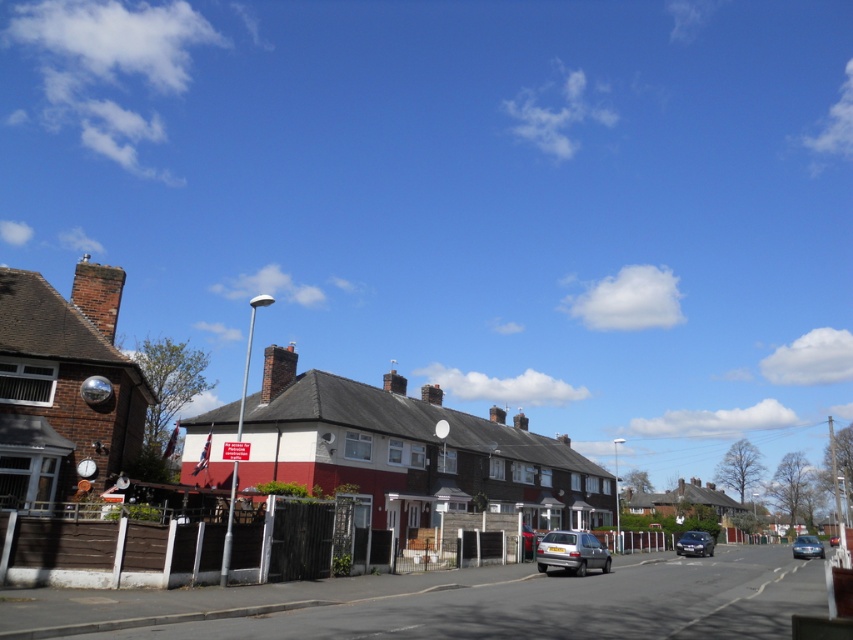
Question: Can you confirm if shiny black sedan at center-right is positioned below metallic blue sedan at right?

Choices:
 (A) no
 (B) yes

Answer: (A)

Question: Is silver metallic hatchback at center to the left of shiny black sedan at center-right from the viewer's perspective?

Choices:
 (A) yes
 (B) no

Answer: (A)

Question: Which object appears closest to the camera in this image?

Choices:
 (A) silver metallic hatchback at center
 (B) metallic blue sedan at right
 (C) shiny black sedan at center-right
 (D) shiny red car at center

Answer: (A)

Question: Which point is farther from the camera taking this photo?

Choices:
 (A) (837, 536)
 (B) (700, 550)

Answer: (A)

Question: Does silver metallic hatchback at center appear over metallic blue sedan at right?

Choices:
 (A) yes
 (B) no

Answer: (A)

Question: Which of the following is the closest to the observer?

Choices:
 (A) silver metallic hatchback at center
 (B) shiny black sedan at center-right

Answer: (A)